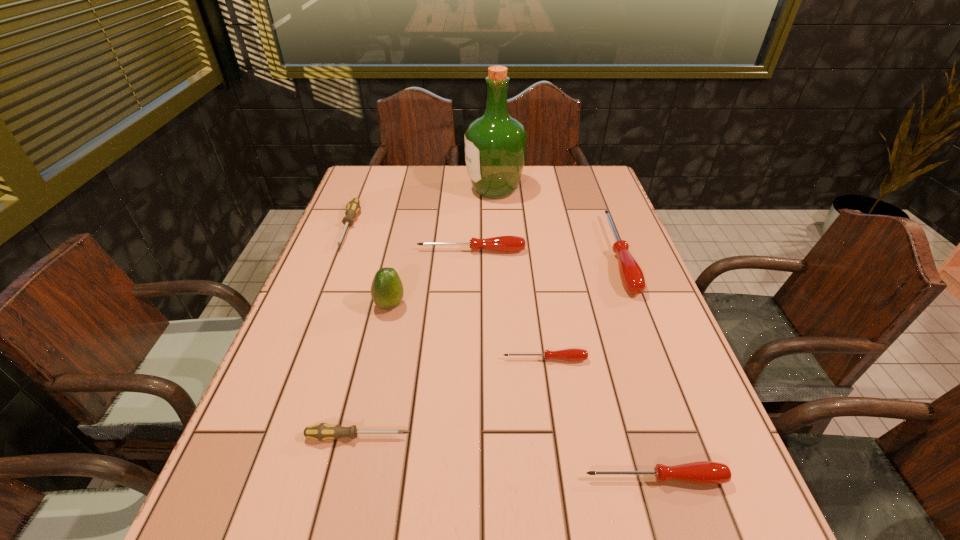
Locate which object is the sixth closest to the nearest object. Please provide its 2D coordinates. Your answer should be formatted as a tuple, i.e. [(x, y)], where the tuple contains the x and y coordinates of a point satisfying the conditions above.

[(353, 207)]

Where is `screwdriver that is the nearest to the second tallest object`? This screenshot has width=960, height=540. screwdriver that is the nearest to the second tallest object is located at coordinates (502, 243).

Locate an element on the screen. screwdriver that is the sixth closest to the farthest object is located at coordinates (702, 472).

Identify the location of red screwdriver that is the nearest to the seventh shortest object. This screenshot has height=540, width=960. (502, 243).

Select which red screwdriver is the third closest to the green avocado. Please provide its 2D coordinates. Your answer should be formatted as a tuple, i.e. [(x, y)], where the tuple contains the x and y coordinates of a point satisfying the conditions above.

[(702, 472)]

The image size is (960, 540). Identify the location of free spot that satisfies the following two spatial constraints: 1. at the tip of the leftmost object; 2. on the right side of the tallest screwdriver. (339, 254).

Identify the location of free space that satisfies the following two spatial constraints: 1. at the tip of the nearest object; 2. on the right side of the second nearest screwdriver. (346, 478).

This screenshot has width=960, height=540. I want to click on free space that satisfies the following two spatial constraints: 1. on the front-facing side of the green liquor; 2. on the back side of the sixth shortest object, so click(x=497, y=254).

What are the coordinates of `vacant area in the image that satisfies the following two spatial constraints: 1. at the tip of the biggest red screwdriver; 2. on the left side of the leftmost object` in the screenshot? It's located at (339, 254).

At what (x,y) coordinates should I click in order to perform the action: click on free region that satisfies the following two spatial constraints: 1. at the tip of the nearest screwdriver; 2. on the left side of the nearer gray screwdriver. Please return your answer as a coordinate pair (x, y). Looking at the image, I should click on (346, 478).